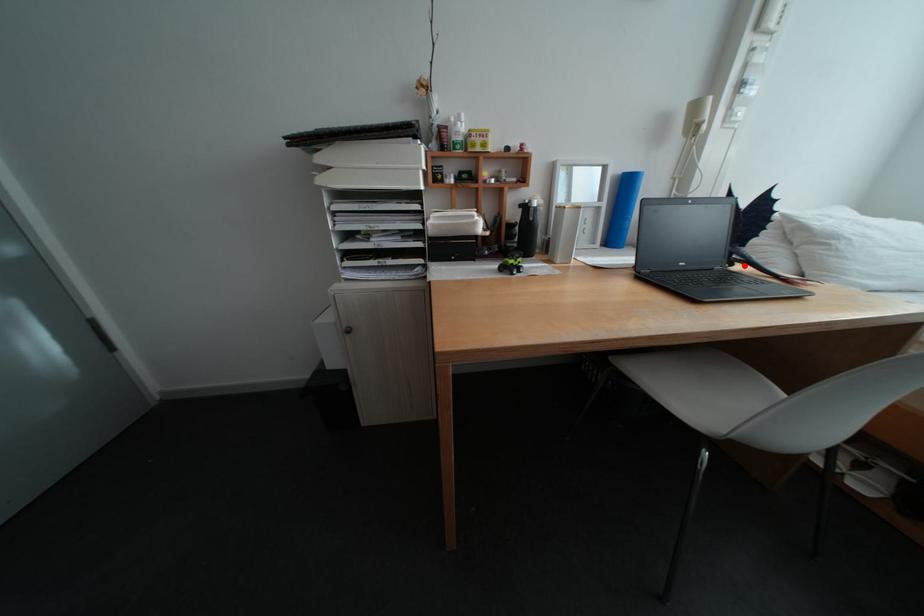
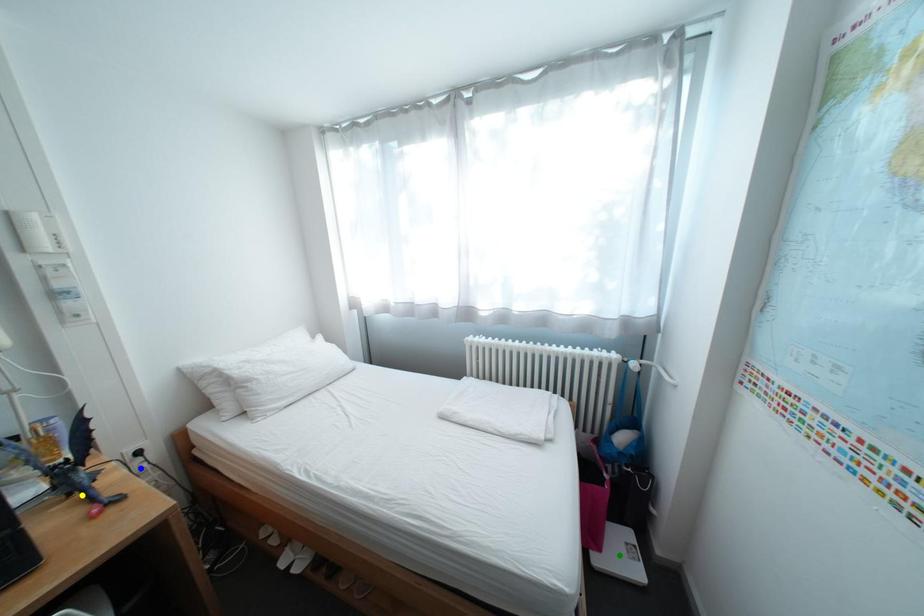
Question: I am providing you with two images of the same scene from different viewpoints. A red point is marked on the first image. You are given multiple points on the second image. Can you choose the point in image 2 that corresponds to the point in image 1?

Choices:
 (A) yellow point
 (B) green point
 (C) blue point

Answer: (A)